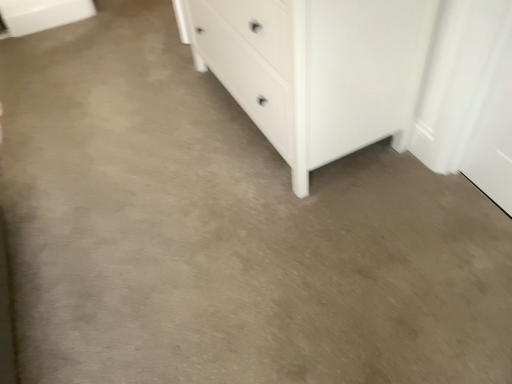
Describe the element at coordinates (42, 14) in the screenshot. The width and height of the screenshot is (512, 384). I see `white matte cabinet at upper left` at that location.

You are a GUI agent. You are given a task and a screenshot of the screen. Output one action in this format:
    pyautogui.click(x=<x>, y=<y>)
    Task: Click on the white matte cabinet at upper left
    The image size is (512, 384).
    Given the screenshot: What is the action you would take?
    pyautogui.click(x=42, y=14)

Describe the element at coordinates (316, 70) in the screenshot. I see `white matte chest of drawers at center` at that location.

Where is `white matte chest of drawers at center`? white matte chest of drawers at center is located at coordinates (316, 70).

At what (x,y) coordinates should I click in order to perform the action: click on white matte cabinet at upper left. Please return your answer as a coordinate pair (x, y). Looking at the image, I should click on coord(42,14).

Is white matte cabinet at upper left to the left or to the right of white matte chest of drawers at center in the image?

From the image, it's evident that white matte cabinet at upper left is to the left of white matte chest of drawers at center.

Considering their positions, is white matte cabinet at upper left located in front of or behind white matte chest of drawers at center?

Visually, white matte cabinet at upper left is located behind white matte chest of drawers at center.

Which is behind, point (10, 0) or point (221, 62)?

The point (10, 0) is more distant.

From the image's perspective, does white matte cabinet at upper left appear lower than white matte chest of drawers at center?

Actually, white matte cabinet at upper left appears above white matte chest of drawers at center in the image.

From a real-world perspective, is white matte cabinet at upper left above or below white matte chest of drawers at center?

white matte cabinet at upper left is situated lower than white matte chest of drawers at center in the real world.

Does white matte cabinet at upper left have a greater width compared to white matte chest of drawers at center?

Incorrect, the width of white matte cabinet at upper left does not surpass that of white matte chest of drawers at center.

Between white matte cabinet at upper left and white matte chest of drawers at center, which one has less height?

Standing shorter between the two is white matte cabinet at upper left.

Who is bigger, white matte cabinet at upper left or white matte chest of drawers at center?

Bigger between the two is white matte chest of drawers at center.

Is white matte cabinet at upper left located outside white matte chest of drawers at center?

white matte cabinet at upper left is positioned outside white matte chest of drawers at center.

In the scene shown: Is white matte cabinet at upper left positioned far away from white matte chest of drawers at center?

That's right, there is a large distance between white matte cabinet at upper left and white matte chest of drawers at center.

Is white matte cabinet at upper left turned away from white matte chest of drawers at center?

No.

This screenshot has height=384, width=512. Find the location of `chest of drawers on the right of the white matte cabinet at upper left`. chest of drawers on the right of the white matte cabinet at upper left is located at coordinates (316, 70).

Which is more to the right, white matte chest of drawers at center or white matte cabinet at upper left?

white matte chest of drawers at center.

Is white matte chest of drawers at center closer to camera compared to white matte cabinet at upper left?

That is True.

Which point is more forward, [350,150] or [91,0]?

Positioned in front is point [350,150].

From the image's perspective, would you say white matte chest of drawers at center is shown under white matte cabinet at upper left?

Indeed, from the image's perspective, white matte chest of drawers at center is shown beneath white matte cabinet at upper left.

From a real-world perspective, is white matte chest of drawers at center located higher than white matte cabinet at upper left?

Indeed, from a real-world perspective, white matte chest of drawers at center stands above white matte cabinet at upper left.

Is white matte chest of drawers at center wider or thinner than white matte cabinet at upper left?

Considering their sizes, white matte chest of drawers at center looks broader than white matte cabinet at upper left.

From their relative heights in the image, would you say white matte chest of drawers at center is taller or shorter than white matte cabinet at upper left?

Clearly, white matte chest of drawers at center is taller compared to white matte cabinet at upper left.

Considering the relative sizes of white matte chest of drawers at center and white matte cabinet at upper left in the image provided, is white matte chest of drawers at center bigger than white matte cabinet at upper left?

Indeed, white matte chest of drawers at center has a larger size compared to white matte cabinet at upper left.

Is white matte chest of drawers at center not within white matte cabinet at upper left?

Indeed, white matte chest of drawers at center is completely outside white matte cabinet at upper left.

Are white matte chest of drawers at center and white matte cabinet at upper left located far from each other?

Yes.

Could you tell me if white matte chest of drawers at center is facing white matte cabinet at upper left?

No, white matte chest of drawers at center is not facing towards white matte cabinet at upper left.

What's the angular difference between white matte chest of drawers at center and white matte cabinet at upper left's facing directions?

white matte chest of drawers at center and white matte cabinet at upper left are facing 88.4 degrees away from each other.

How far apart are white matte chest of drawers at center and white matte cabinet at upper left?

The distance of white matte chest of drawers at center from white matte cabinet at upper left is 1.55 meters.

Where is `chest of drawers that is on the right side of white matte cabinet at upper left`? The width and height of the screenshot is (512, 384). chest of drawers that is on the right side of white matte cabinet at upper left is located at coordinates (316, 70).

In order to click on cabinetry behind the white matte chest of drawers at center in this screenshot , I will do `click(42, 14)`.

You are a GUI agent. You are given a task and a screenshot of the screen. Output one action in this format:
    pyautogui.click(x=<x>, y=<y>)
    Task: Click on the chest of drawers located below the white matte cabinet at upper left (from the image's perspective)
    
    Given the screenshot: What is the action you would take?
    pyautogui.click(x=316, y=70)